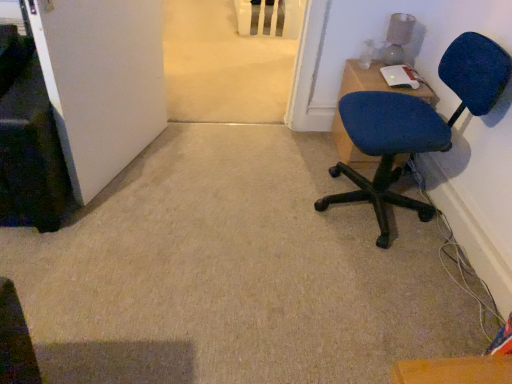
Question: Can you confirm if white matte door at lower left is wider than blue fabric chair at right?

Choices:
 (A) no
 (B) yes

Answer: (A)

Question: Is white matte door at lower left positioned beyond the bounds of blue fabric chair at right?

Choices:
 (A) no
 (B) yes

Answer: (B)

Question: Is white matte door at lower left positioned in front of blue fabric chair at right?

Choices:
 (A) yes
 (B) no

Answer: (A)

Question: Is white matte door at lower left taller than blue fabric chair at right?

Choices:
 (A) yes
 (B) no

Answer: (A)

Question: Is white matte door at lower left further to camera compared to blue fabric chair at right?

Choices:
 (A) no
 (B) yes

Answer: (A)

Question: Is white matte door at lower left oriented towards blue fabric chair at right?

Choices:
 (A) yes
 (B) no

Answer: (A)

Question: Does blue fabric chair at upper right appear on the left side of white matte door at lower left?

Choices:
 (A) yes
 (B) no

Answer: (B)

Question: Does blue fabric chair at upper right lie behind white matte door at lower left?

Choices:
 (A) no
 (B) yes

Answer: (B)

Question: From the image's perspective, does blue fabric chair at upper right appear lower than white matte door at lower left?

Choices:
 (A) yes
 (B) no

Answer: (A)

Question: Considering the relative sizes of blue fabric chair at upper right and white matte door at lower left in the image provided, is blue fabric chair at upper right wider than white matte door at lower left?

Choices:
 (A) no
 (B) yes

Answer: (B)

Question: Is blue fabric chair at upper right positioned with its back to white matte door at lower left?

Choices:
 (A) no
 (B) yes

Answer: (A)

Question: From a real-world perspective, is blue fabric chair at upper right located higher than white matte door at lower left?

Choices:
 (A) yes
 (B) no

Answer: (B)

Question: Is blue fabric chair at right taller than blue fabric chair at upper right?

Choices:
 (A) yes
 (B) no

Answer: (A)